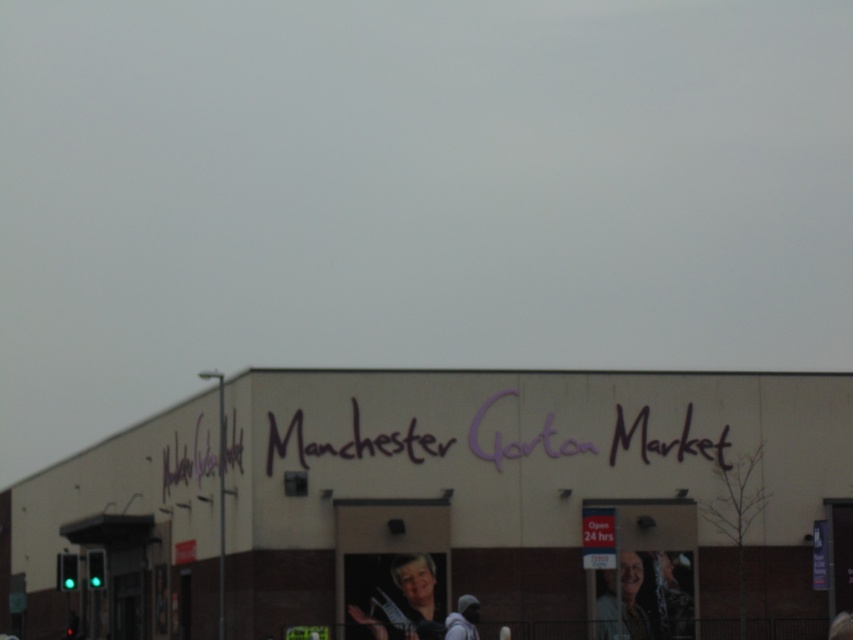
Is matte black jacket at lower center positioned behind smooth plastic poster at lower right?

No.

Does matte black jacket at lower center have a larger size compared to smooth plastic poster at lower right?

Correct, matte black jacket at lower center is larger in size than smooth plastic poster at lower right.

Who is more forward, (x=399, y=618) or (x=607, y=604)?

Point (x=399, y=618) is more forward.

The height and width of the screenshot is (640, 853). I want to click on matte black jacket at lower center, so click(393, 593).

Between white matte building at center and matte black jacket at lower center, which one appears on the left side from the viewer's perspective?

From the viewer's perspective, white matte building at center appears more on the left side.

Which is above, white matte building at center or matte black jacket at lower center?

white matte building at center

Is point (67, 614) positioned before point (374, 579)?

No, (67, 614) is behind (374, 579).

This screenshot has height=640, width=853. In order to click on white matte building at center in this screenshot , I will do `click(440, 506)`.

Between white matte building at center and smooth plastic poster at lower right, which one is positioned lower?

smooth plastic poster at lower right

Does white matte building at center lie behind smooth plastic poster at lower right?

No, white matte building at center is closer to the viewer.

Which is behind, point (328, 496) or point (634, 566)?

The point (634, 566) is behind.

I want to click on white matte building at center, so click(440, 506).